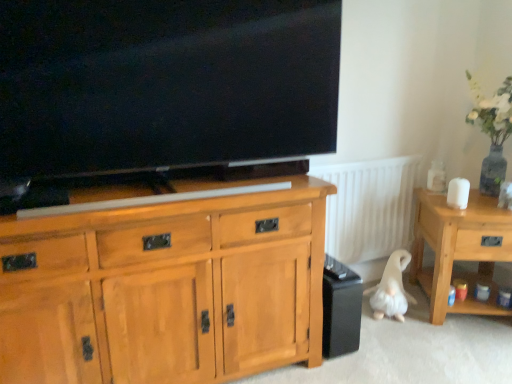
Where is `free location in front of black matte speaker at lower right`? The height and width of the screenshot is (384, 512). free location in front of black matte speaker at lower right is located at coordinates (341, 371).